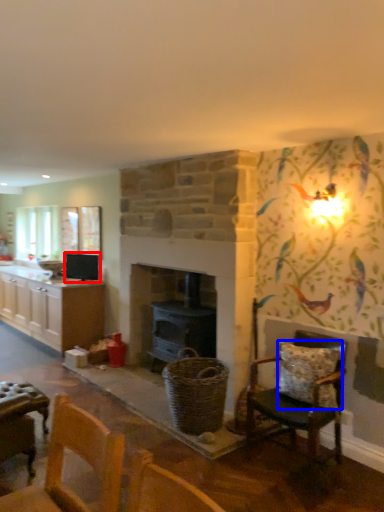
Question: Which object appears closest to the camera in this image, appliance (highlighted by a red box) or pillow (highlighted by a blue box)?

Choices:
 (A) appliance
 (B) pillow

Answer: (B)